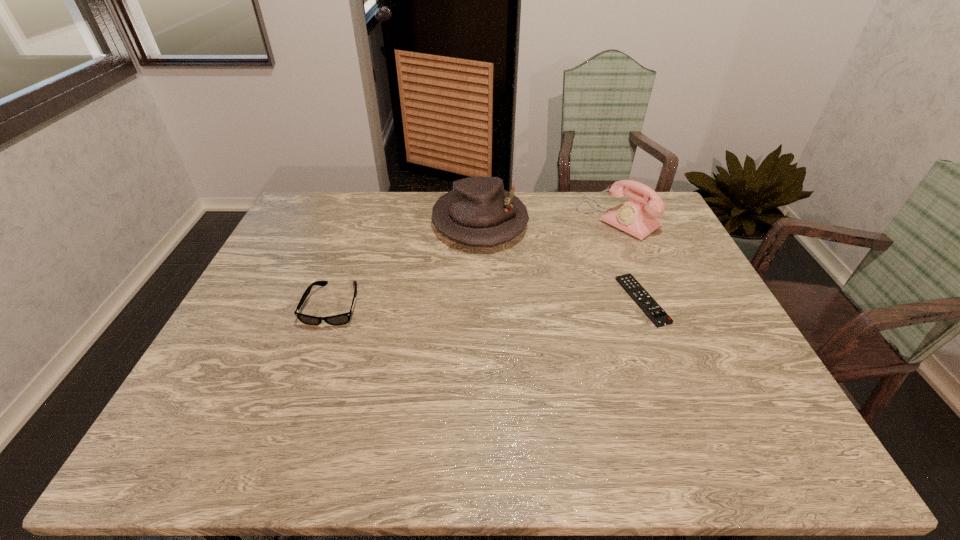
Where is `vacant space on the desktop that is between the leftmost object and the shortest object and is positioned on the decorative side of the second object from left to right`? This screenshot has height=540, width=960. vacant space on the desktop that is between the leftmost object and the shortest object and is positioned on the decorative side of the second object from left to right is located at coordinates (508, 302).

The image size is (960, 540). I want to click on free space on the desktop that is between the sunglasses and the remote control and is positioned on the dial of the telephone, so [492, 302].